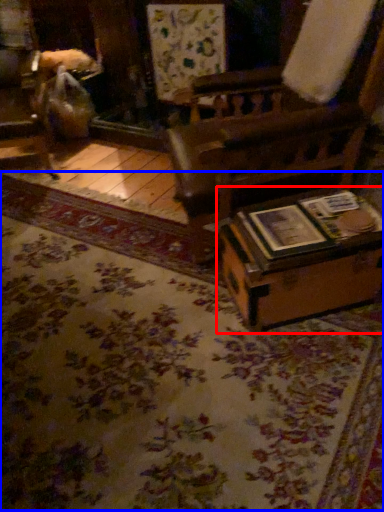
Question: Which object is closer to the camera taking this photo, table (highlighted by a red box) or mat (highlighted by a blue box)?

Choices:
 (A) table
 (B) mat

Answer: (B)